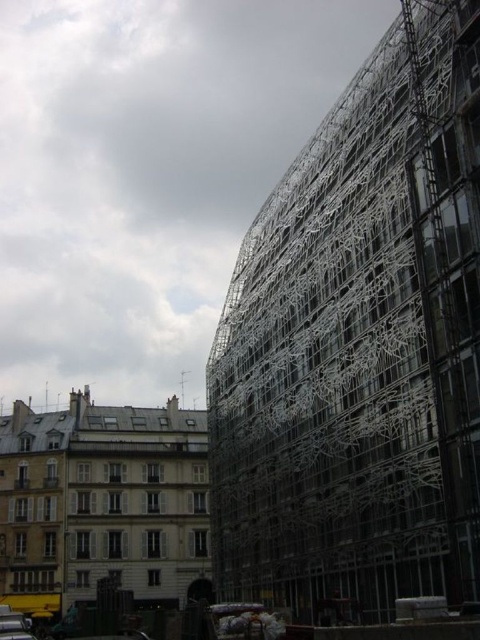
Who is shorter, metallic scaffolding at right or metallic silver car at lower left?

With less height is metallic silver car at lower left.

Which is behind, point (466, 195) or point (7, 634)?

Positioned behind is point (7, 634).

Which is behind, point (411, 384) or point (10, 627)?

Point (10, 627)

Image resolution: width=480 pixels, height=640 pixels. Identify the location of metallic scaffolding at right. (360, 346).